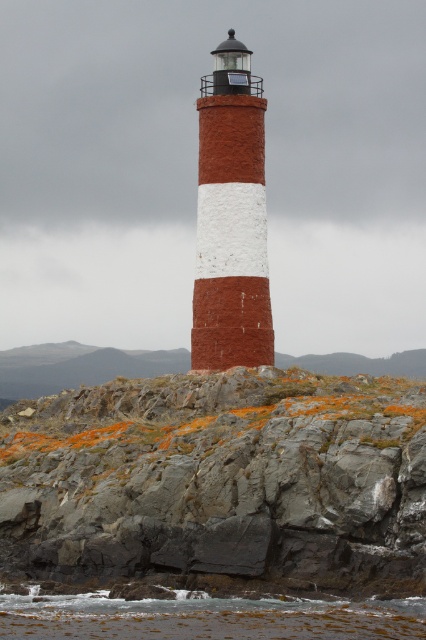
You are a photographer planning to capture the brick red lighthouse at center and the clear water at lower center in a single frame. Based on their widths, which object should you position closer to the edge of the frame to ensure both fit without cropping?

The brick red lighthouse at center has a lesser width compared to clear water at lower center, so you should position the brick red lighthouse at center closer to the edge of the frame to ensure both fit without cropping.

You are a bird flying over the rocky area and want to land on a safe spot. You see the gray rock at center and the brick red lighthouse at center. Which one is closer to you as you approach from above?

The gray rock at center is in front of the brick red lighthouse at center, so it is closer to you as you approach from above.